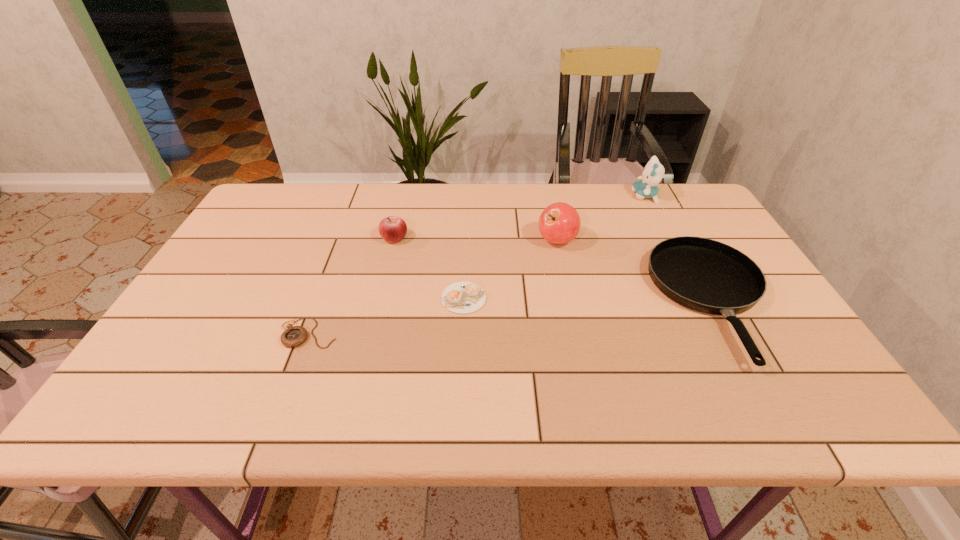
Locate an element on the screen. frying pan present at the right edge is located at coordinates (702, 274).

Find the location of a particular element. This screenshot has height=540, width=960. object present at the far right corner is located at coordinates (652, 174).

You are a GUI agent. You are given a task and a screenshot of the screen. Output one action in this format:
    pyautogui.click(x=<x>, y=<y>)
    Task: Click on the vacant space at the far edge of the desktop
    The height and width of the screenshot is (540, 960).
    Given the screenshot: What is the action you would take?
    pyautogui.click(x=623, y=193)

Locate an element on the screen. This screenshot has width=960, height=540. free space at the left edge of the desktop is located at coordinates (276, 238).

You are a GUI agent. You are given a task and a screenshot of the screen. Output one action in this format:
    pyautogui.click(x=<x>, y=<y>)
    Task: Click on the free spot at the far left corner of the desktop
    The height and width of the screenshot is (540, 960).
    Given the screenshot: What is the action you would take?
    pyautogui.click(x=258, y=208)

In the image, there is a desktop. At what (x,y) coordinates should I click in order to perform the action: click on vacant space at the far right corner. Please return your answer as a coordinate pair (x, y). The image size is (960, 540). Looking at the image, I should click on (706, 204).

In order to click on unoccupied area between the leftmost object and the cappuccino in this screenshot , I will do `click(387, 315)`.

Where is `free space between the frying pan and the pocket watch`? This screenshot has width=960, height=540. free space between the frying pan and the pocket watch is located at coordinates (512, 317).

Where is `vacant area between the taller apple and the farthest object`? The image size is (960, 540). vacant area between the taller apple and the farthest object is located at coordinates (601, 218).

Locate an element on the screen. vacant point located between the fifth tallest object and the right apple is located at coordinates (511, 269).